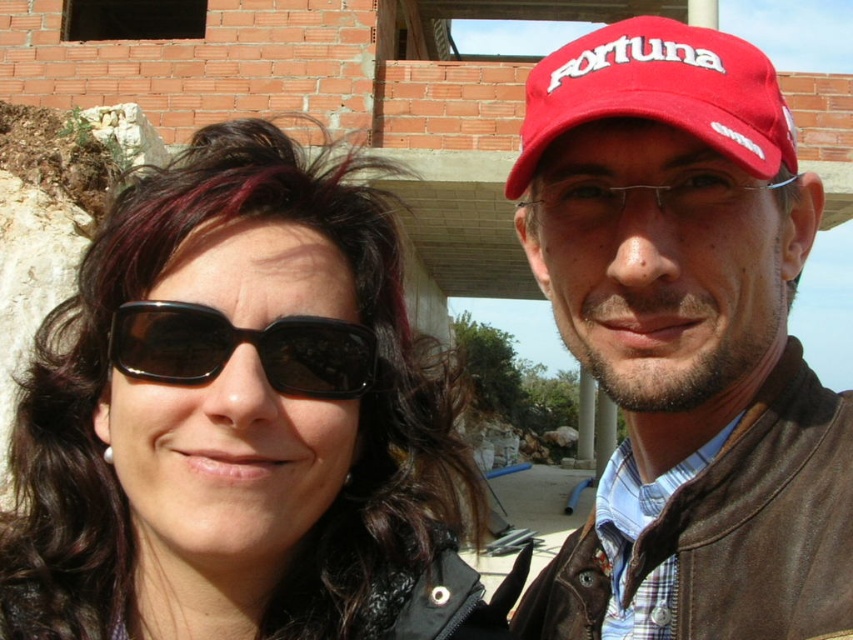
You are a photographer trying to capture a photo of the matte leather jacket at right and the black matte sunglasses at upper left. Which object should you focus on first if you want to start from the left side of the scene?

You should focus on the black matte sunglasses at upper left first because it is positioned to the left of the matte leather jacket at right.

You are a photographer adjusting your camera to focus on the black matte sunglasses at upper left. What coordinates should you set in the camera viewfinder to ensure the sunglasses are centered?

Set the coordinates to approximately 0.659 on the x axis and 0.281 on the y axis to center the black matte sunglasses at upper left in the camera viewfinder.

You are a photographer adjusting your camera to focus on two points in the scene. The first point is point (x=599, y=342) and the second is point (x=741, y=147). Since you can only focus on one point at a time, which point should you choose to ensure the other point is also in focus?

You should focus on point (x=741, y=147) because it is farther from the viewer than point (x=599, y=342). By focusing on the farther point, the closer point will also be within the depth of field, ensuring both are in focus.